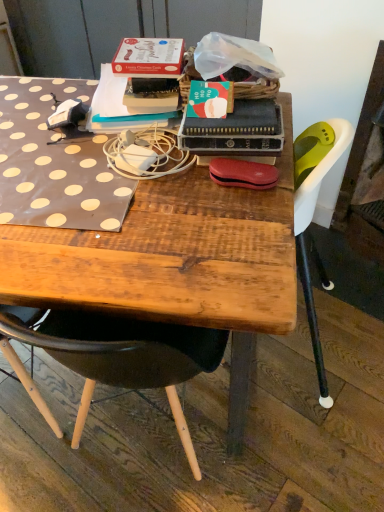
Question: Is matte red pouch at center a part of white matte charger at center?

Choices:
 (A) no
 (B) yes

Answer: (A)

Question: From a real-world perspective, is white matte charger at center under matte red pouch at center?

Choices:
 (A) yes
 (B) no

Answer: (A)

Question: Does white matte charger at center turn towards matte red pouch at center?

Choices:
 (A) yes
 (B) no

Answer: (B)

Question: Considering the relative sizes of white matte charger at center and matte red pouch at center in the image provided, is white matte charger at center shorter than matte red pouch at center?

Choices:
 (A) no
 (B) yes

Answer: (B)

Question: Does white matte charger at center have a lesser width compared to matte red pouch at center?

Choices:
 (A) yes
 (B) no

Answer: (B)

Question: Is white matte charger at center outside matte red pouch at center?

Choices:
 (A) yes
 (B) no

Answer: (A)

Question: From a real-world perspective, is matte red pouch at center located beneath wooden desk at center?

Choices:
 (A) yes
 (B) no

Answer: (B)

Question: From the image's perspective, is matte red pouch at center on wooden desk at center?

Choices:
 (A) no
 (B) yes

Answer: (B)

Question: Considering the relative positions of matte red pouch at center and wooden desk at center in the image provided, is matte red pouch at center to the left of wooden desk at center from the viewer's perspective?

Choices:
 (A) no
 (B) yes

Answer: (A)

Question: Could you tell me if matte red pouch at center is facing wooden desk at center?

Choices:
 (A) no
 (B) yes

Answer: (A)

Question: Considering the relative positions of matte red pouch at center and wooden desk at center in the image provided, is matte red pouch at center in front of wooden desk at center?

Choices:
 (A) no
 (B) yes

Answer: (A)

Question: Does matte red pouch at center have a greater width compared to wooden desk at center?

Choices:
 (A) yes
 (B) no

Answer: (B)

Question: From a real-world perspective, is hardcover book at center located beneath wooden desk at center?

Choices:
 (A) no
 (B) yes

Answer: (A)